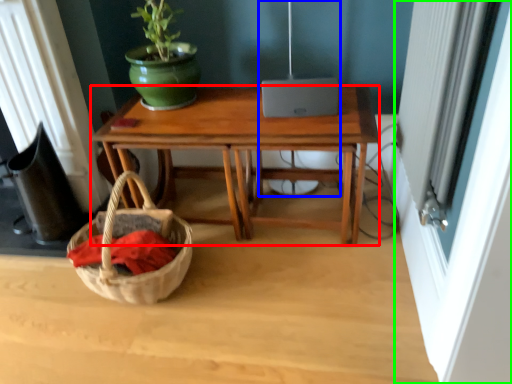
Question: Which is nearer to the desk (highlighted by a red box)? lamp (highlighted by a blue box) or screen door (highlighted by a green box).

Choices:
 (A) lamp
 (B) screen door

Answer: (A)